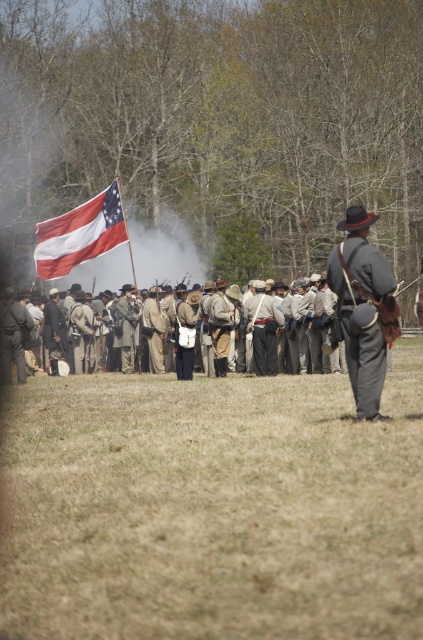
You are a photographer positioned at the camera. You want to take a photo that includes both the point at coordinates point (381, 340) and point (76, 214). Which point should you focus on to ensure both are in sharp focus?

You should focus on point (381, 340) because it is closer to the camera than point (76, 214). By focusing on the closer point, the depth of field will likely include the farther point in acceptable focus.